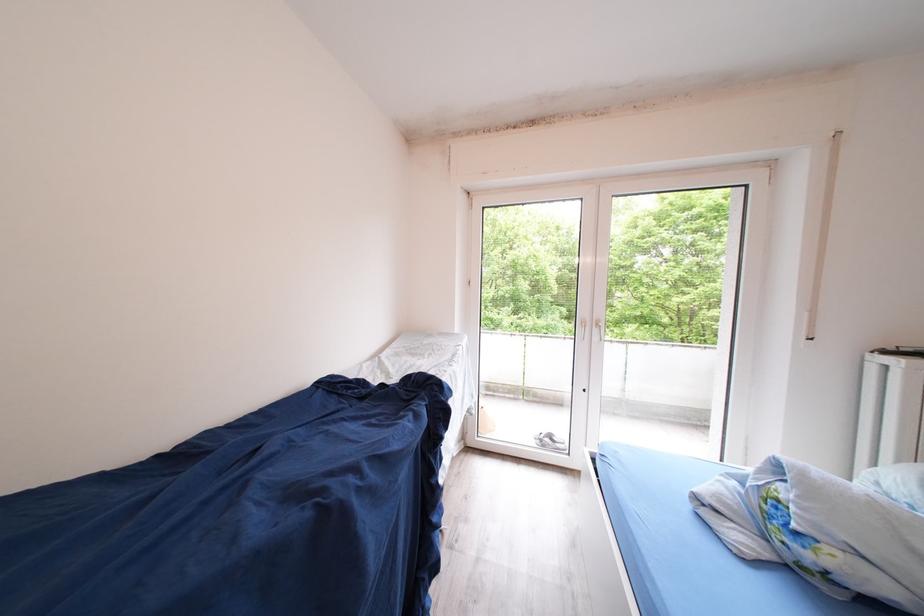
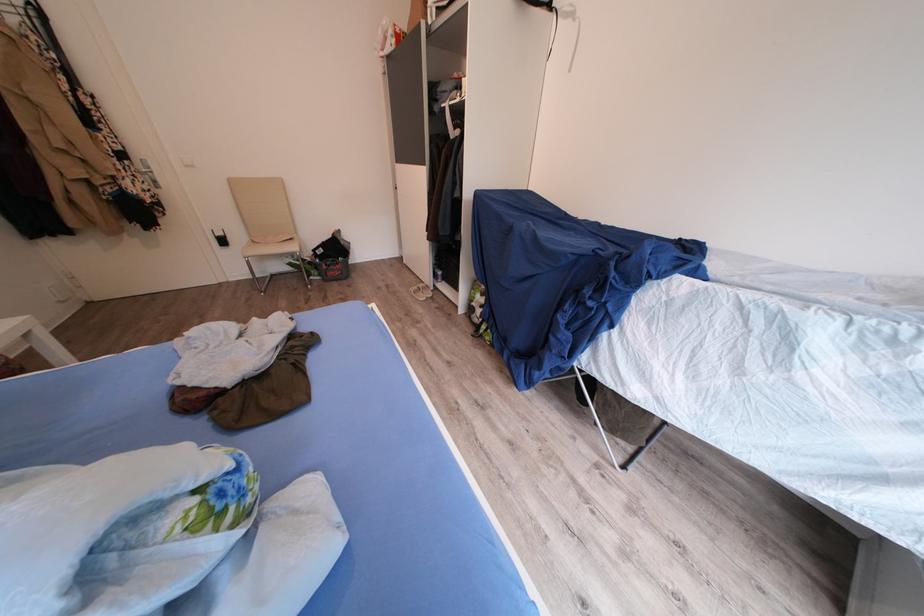
Find the pixel in the second image that matches point 787,506 in the first image.

(213, 507)